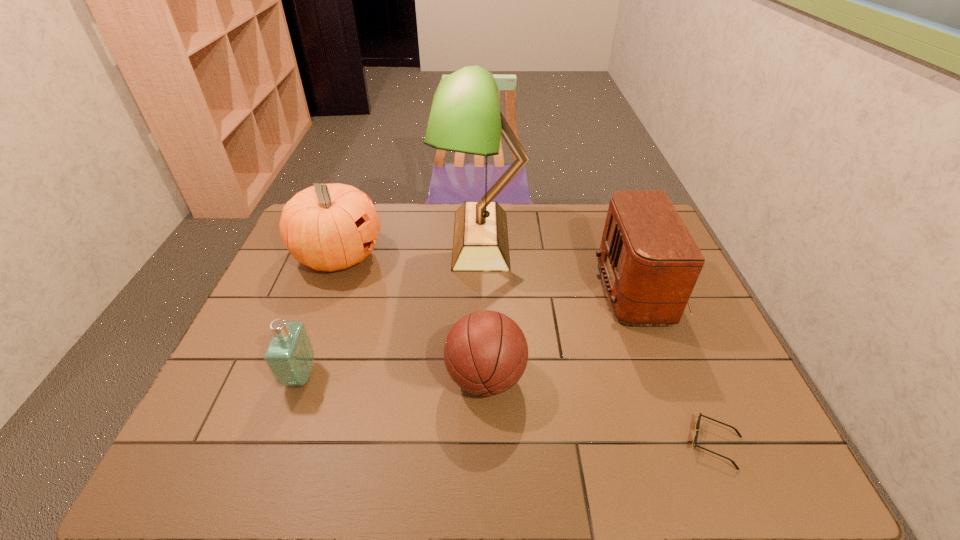
In order to click on pumpkin present at the far edge in this screenshot , I will do `click(328, 227)`.

The width and height of the screenshot is (960, 540). What are the coordinates of `object located in the near edge section of the desktop` in the screenshot? It's located at (699, 417).

What are the coordinates of `pumpkin that is at the left edge` in the screenshot? It's located at (328, 227).

This screenshot has height=540, width=960. Identify the location of perfume present at the left edge. (289, 356).

Identify the location of radio receiver positioned at the right edge. This screenshot has height=540, width=960. (649, 262).

The height and width of the screenshot is (540, 960). In order to click on sunglasses that is at the right edge in this screenshot , I will do `click(699, 417)`.

At what (x,y) coordinates should I click in order to perform the action: click on object that is at the far left corner. Please return your answer as a coordinate pair (x, y). Looking at the image, I should click on (328, 227).

Image resolution: width=960 pixels, height=540 pixels. Find the location of `object positioned at the near right corner`. object positioned at the near right corner is located at coordinates (699, 417).

The height and width of the screenshot is (540, 960). Identify the location of free spot at the far edge of the desktop. (521, 216).

Find the location of `free region at the near edge`. free region at the near edge is located at coordinates (364, 466).